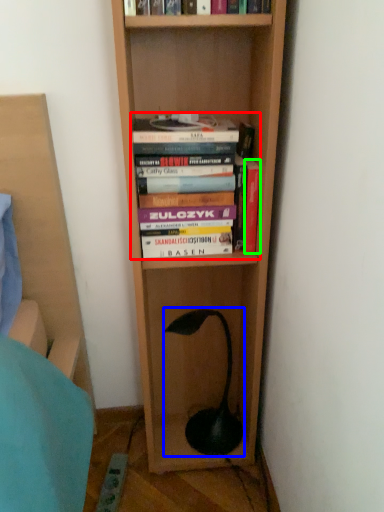
Question: Which object is the farthest from book (highlighted by a red box)? Choose among these: lamp (highlighted by a blue box) or book (highlighted by a green box).

Choices:
 (A) lamp
 (B) book

Answer: (A)